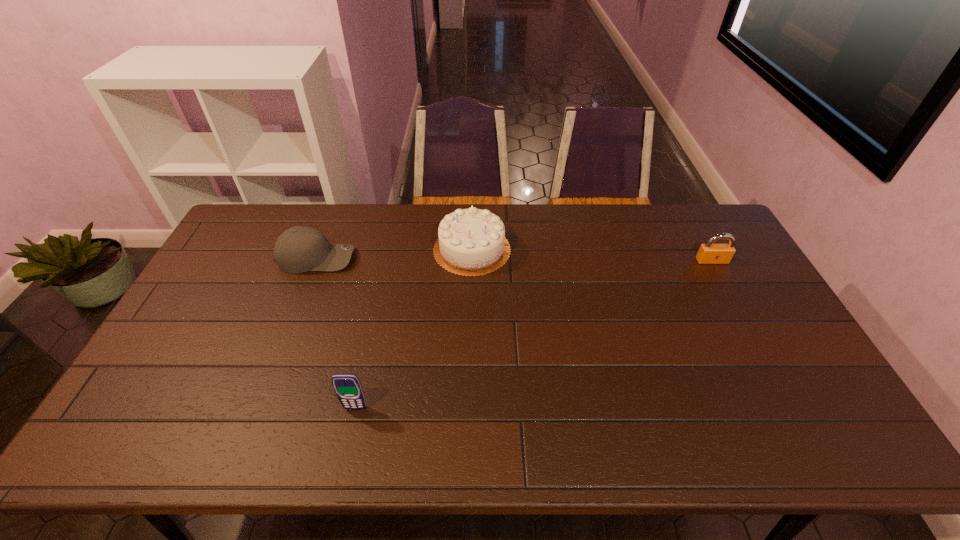
I want to click on the third object from left to right, so coord(472,242).

Locate an element on the screen. the second object from left to right is located at coordinates (347, 386).

You are a GUI agent. You are given a task and a screenshot of the screen. Output one action in this format:
    pyautogui.click(x=<x>, y=<y>)
    Task: Click on the cellular telephone
    
    Given the screenshot: What is the action you would take?
    pyautogui.click(x=347, y=386)

At what (x,y) coordinates should I click in order to perform the action: click on baseball cap. Please return your answer as a coordinate pair (x, y). This screenshot has height=540, width=960. Looking at the image, I should click on (299, 249).

Find the location of `the rightmost object`. the rightmost object is located at coordinates (709, 253).

You are a GUI agent. You are given a task and a screenshot of the screen. Output one action in this format:
    pyautogui.click(x=<x>, y=<y>)
    Task: Click on the vacant space located on the right of the birthday cake
    
    Given the screenshot: What is the action you would take?
    pyautogui.click(x=621, y=249)

Find the location of `vacant area situated 0.120m on the front brim of the baseball cap`. vacant area situated 0.120m on the front brim of the baseball cap is located at coordinates (391, 258).

This screenshot has height=540, width=960. I want to click on free location located 0.180m to unlock the rightmost object from the front, so click(736, 305).

You are a GUI agent. You are given a task and a screenshot of the screen. Output one action in this format:
    pyautogui.click(x=<x>, y=<y>)
    Task: Click on the birthday cake present at the far edge
    Image resolution: width=960 pixels, height=540 pixels.
    Given the screenshot: What is the action you would take?
    pyautogui.click(x=472, y=242)

The height and width of the screenshot is (540, 960). Find the location of `baseball cap present at the far edge`. baseball cap present at the far edge is located at coordinates pyautogui.click(x=299, y=249).